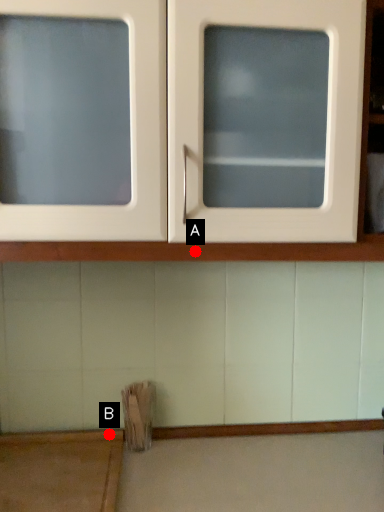
Question: Two points are circled on the image, labeled by A and B beside each circle. Which point appears farthest from the camera in this image?

Choices:
 (A) A is further
 (B) B is further

Answer: (B)